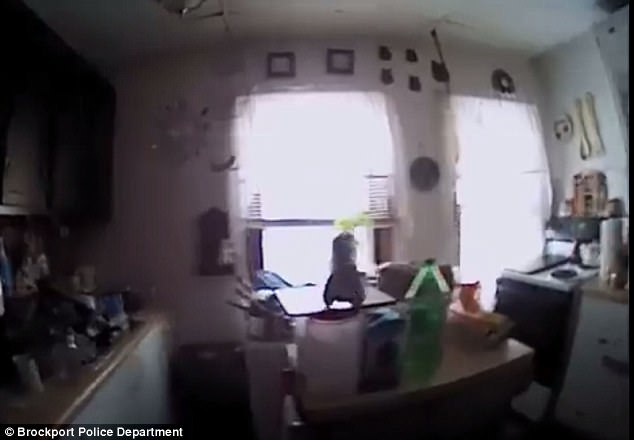
Locate an element on the screen. trash can is located at coordinates (226, 371).